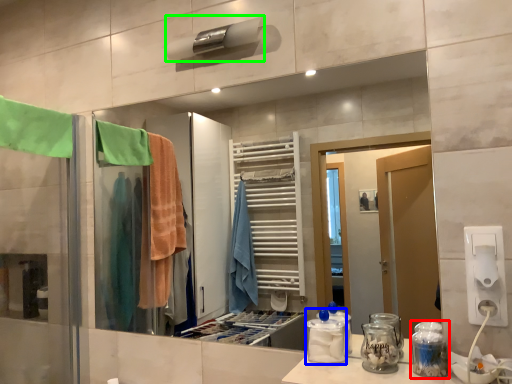
Question: Estimate the real-world distances between objects in this image. Which object is closer to glass jar (highlighted by a red box), bottle (highlighted by a blue box) or towel bar (highlighted by a green box)?

Choices:
 (A) bottle
 (B) towel bar

Answer: (A)